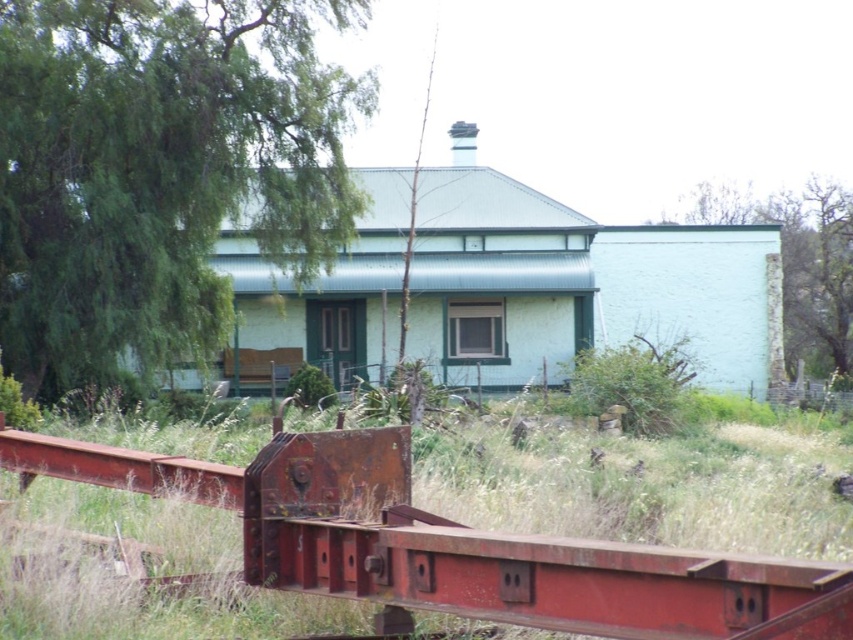
You are standing in front of the house and want to walk from the green leafy tree at upper left to the green rough stone wall at upper right. Which direction should you move relative to the house?

You should move to the right relative to the house because the green leafy tree at upper left is positioned on the left side of the green rough stone wall at upper right.

You are planning to install a new fence between the green leafy tree at upper left and the green rough stone wall at upper right. Which object has a smaller width, requiring the fence to be closer to it to save space?

The green leafy tree at upper left has a smaller width than the green rough stone wall at upper right, so the fence should be placed closer to the green leafy tree at upper left to save space.